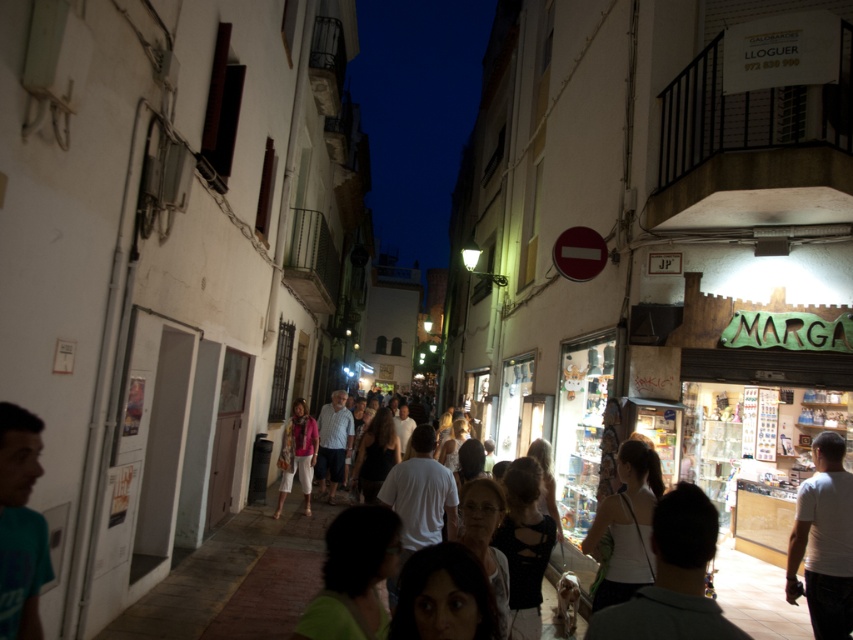
Question: Is white matte tank top at center bigger than matte pink sweater at center?

Choices:
 (A) no
 (B) yes

Answer: (A)

Question: Which object is the farthest from the white matte tank top at center?

Choices:
 (A) matte pink sweater at center
 (B) white matte shirt at right

Answer: (A)

Question: Can you confirm if white matte tank top at center is positioned above matte pink sweater at center?

Choices:
 (A) yes
 (B) no

Answer: (A)

Question: Based on their relative distances, which object is farther from the white matte tank top at center?

Choices:
 (A) white matte shirt at right
 (B) matte pink sweater at center

Answer: (B)

Question: Is white matte shirt at right smaller than white matte tank top at center?

Choices:
 (A) no
 (B) yes

Answer: (B)

Question: Which of the following is the farthest from the observer?

Choices:
 (A) (833, 596)
 (B) (595, 534)
 (C) (289, 483)

Answer: (C)